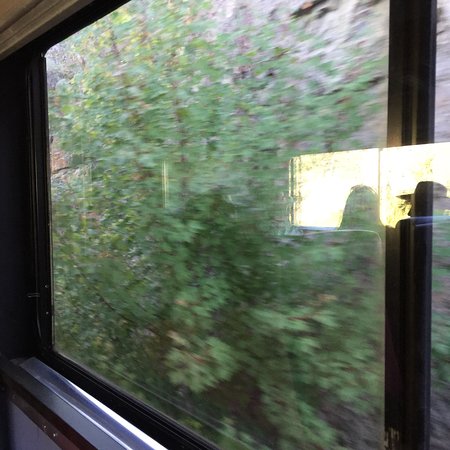
Identify the location of light. (335, 185).